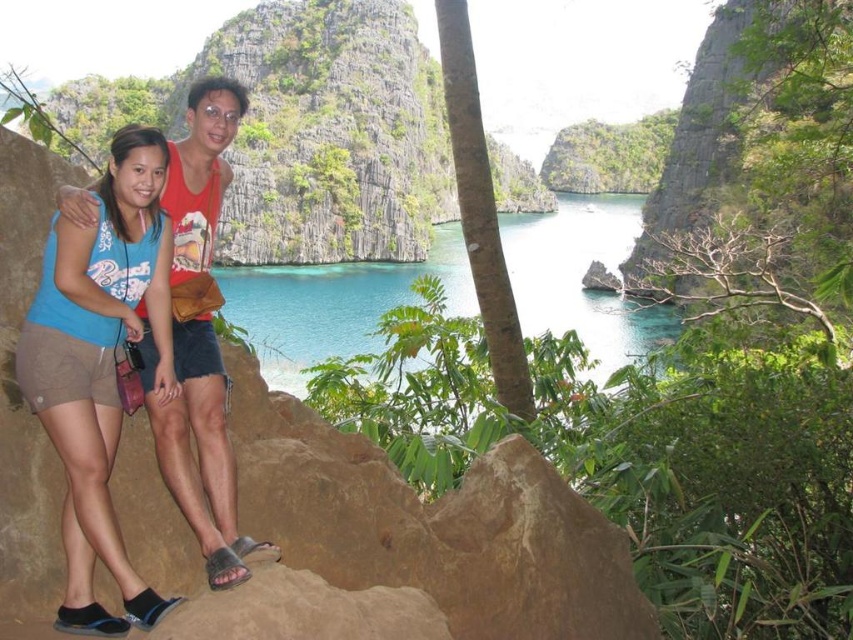
Question: Does blue fabric shorts at lower left have a lesser width compared to matte red tank top at center?

Choices:
 (A) yes
 (B) no

Answer: (A)

Question: Does blue fabric shorts at lower left appear on the right side of clear blue water at center?

Choices:
 (A) no
 (B) yes

Answer: (A)

Question: Estimate the real-world distances between objects in this image. Which object is closer to the clear blue water at center?

Choices:
 (A) blue fabric shorts at lower left
 (B) matte red tank top at center

Answer: (A)

Question: Which point is closer to the camera?

Choices:
 (A) clear blue water at center
 (B) matte red tank top at center
 (C) blue fabric shorts at lower left

Answer: (C)

Question: Does clear blue water at center have a greater width compared to matte red tank top at center?

Choices:
 (A) yes
 (B) no

Answer: (A)

Question: Which object appears closest to the camera in this image?

Choices:
 (A) clear blue water at center
 (B) blue fabric shorts at lower left

Answer: (B)